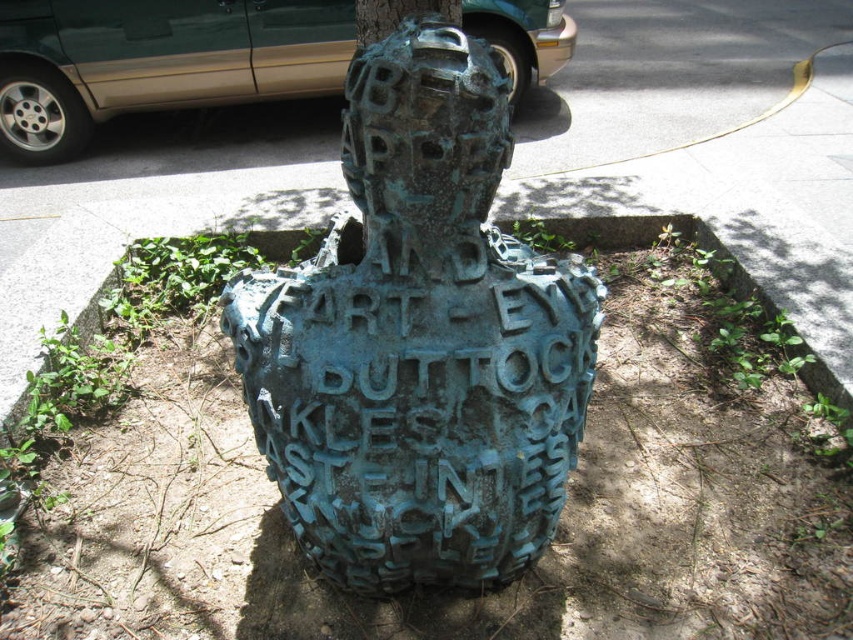
Is green patina metal sculpture at center positioned before green rough bark at upper center?

Yes, it is.

Based on the photo, which is more to the left, green patina metal sculpture at center or green rough bark at upper center?

green rough bark at upper center is more to the left.

What do you see at coordinates (419, 340) in the screenshot?
I see `green patina metal sculpture at center` at bounding box center [419, 340].

Identify the location of green patina metal sculpture at center. (419, 340).

In the scene shown: Who is positioned more to the left, green patina metal sculpture at center or green matte van at upper left?

green matte van at upper left

Who is more distant from viewer, [351,118] or [260,45]?

The point [260,45] is more distant.

Is point (345, 500) positioned before point (194, 81)?

Yes.

You are a GUI agent. You are given a task and a screenshot of the screen. Output one action in this format:
    pyautogui.click(x=<x>, y=<y>)
    Task: Click on the green patina metal sculpture at center
    The width and height of the screenshot is (853, 640).
    Given the screenshot: What is the action you would take?
    pyautogui.click(x=419, y=340)

Consider the image. Who is positioned more to the right, green matte van at upper left or green rough bark at upper center?

green rough bark at upper center is more to the right.

Between green matte van at upper left and green rough bark at upper center, which one is positioned lower?

green rough bark at upper center is lower down.

Is point (62, 70) closer to camera compared to point (363, 12)?

No, (62, 70) is behind (363, 12).

Find the location of a particular element. The height and width of the screenshot is (640, 853). green matte van at upper left is located at coordinates (155, 61).